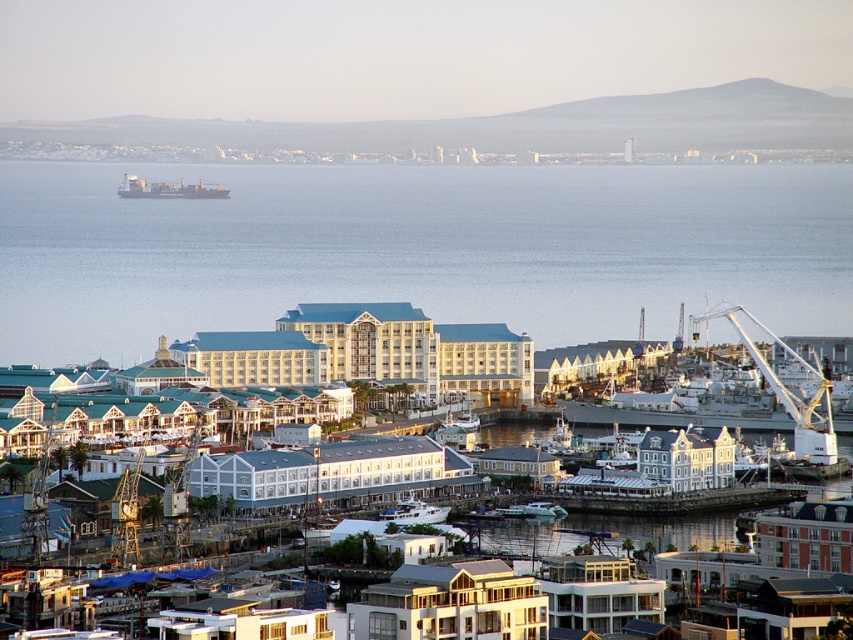
Which is more to the right, blue water at center or white glossy building at center?

Positioned to the right is white glossy building at center.

You are a GUI agent. You are given a task and a screenshot of the screen. Output one action in this format:
    pyautogui.click(x=<x>, y=<y>)
    Task: Click on the blue water at center
    
    Given the screenshot: What is the action you would take?
    pyautogui.click(x=416, y=250)

Is white metallic crane at right to the right of white glossy boat at center from the viewer's perspective?

Result: Correct, you'll find white metallic crane at right to the right of white glossy boat at center.

Does white metallic crane at right lie in front of white glossy boat at center?

No.

Does point (776, 348) come closer to viewer compared to point (436, 508)?

No, it is not.

Find the location of a particular element. This screenshot has width=853, height=640. white metallic crane at right is located at coordinates (791, 390).

Who is lower down, matte gray cargo ship at upper left or white glossy boat at center?

white glossy boat at center is below.

Between matte gray cargo ship at upper left and white glossy boat at center, which one has less height?

With less height is matte gray cargo ship at upper left.

Between point (129, 177) and point (413, 502), which one is positioned in front?

Point (413, 502)

Where is `matte gray cargo ship at upper left`? The image size is (853, 640). matte gray cargo ship at upper left is located at coordinates (167, 189).